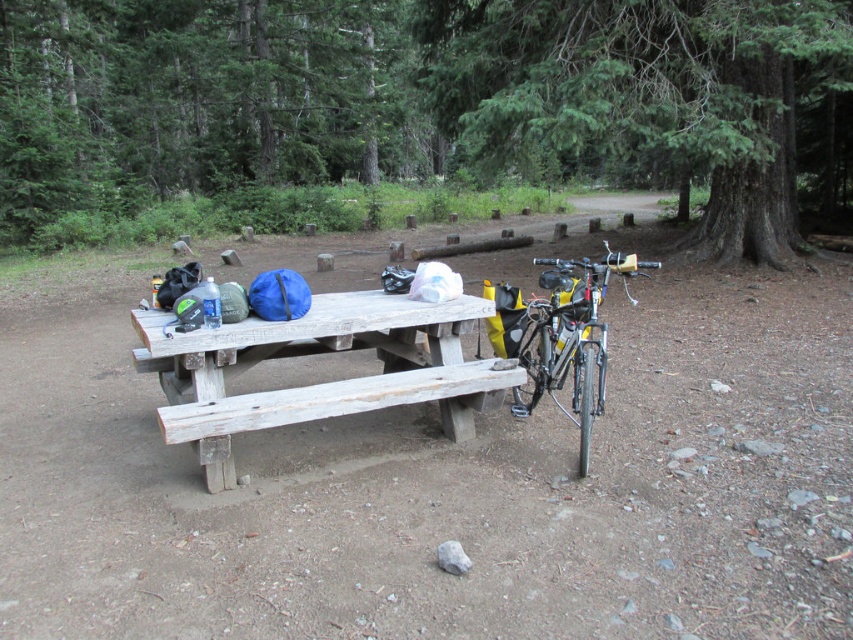
You are a hiker who wants to take a photo of the green textured tree at upper right. You are standing at the picnic table. Which direction should you face to capture the tree in your camera?

The green textured tree at upper right is located at point (647,93), which is to the upper right direction from the picnic table. Therefore, you should face the upper right direction to capture the tree in your camera.

You are planning to set up a tent in this campsite. Considering the green textured tree at upper center and the green textured tree at upper right, which tree would provide more shade over the picnic table during midday?

The green textured tree at upper center is much taller than the green textured tree at upper right, so it would provide more shade over the picnic table during midday.

You are standing at the campsite and want to place a new item on the picnic table. You have two points marked on the table surface where you can place it. The first point is at coordinates point (x=795, y=54) and the second is at point (x=131, y=320). Which point is closer to you, so you can easily reach it without moving?

Point (x=795, y=54) is closer to the viewer than point (x=131, y=320), so you can easily reach it without moving.